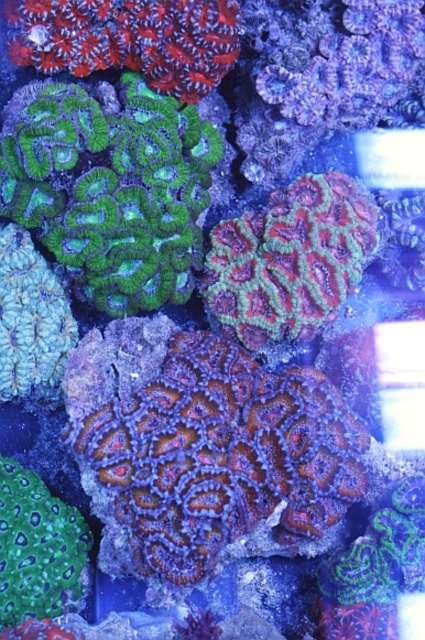
You are a marine biologist studying underwater coral formations. You notice a point marked at coordinates (204, 449) in the image. Based on the scene description, what type of coral is located at this point?

The point at (204, 449) indicates textured coral at center.